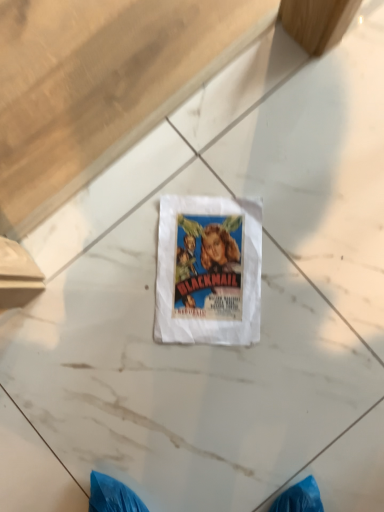
This screenshot has height=512, width=384. What do you see at coordinates (208, 271) in the screenshot?
I see `colorful paper poster at center` at bounding box center [208, 271].

The height and width of the screenshot is (512, 384). Identify the location of colorful paper poster at center. (208, 271).

Where is `colorful paper poster at center`? The width and height of the screenshot is (384, 512). colorful paper poster at center is located at coordinates (208, 271).